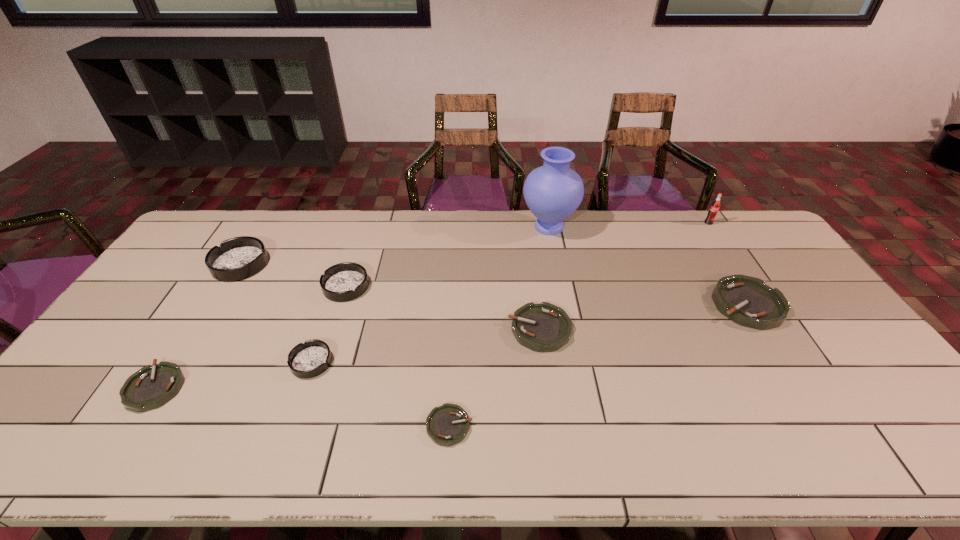
This screenshot has height=540, width=960. I want to click on green ashtray object that ranks as the third closest to the rightmost ashtray, so click(151, 387).

Identify which green ashtray is the third closest to the tallest object. Please provide its 2D coordinates. Your answer should be formatted as a tuple, i.e. [(x, y)], where the tuple contains the x and y coordinates of a point satisfying the conditions above.

[(446, 425)]

Find the location of `free space that satisfies the following two spatial constraints: 1. on the front side of the rightmost ashtray; 2. on the left side of the seventh shortest object`. free space that satisfies the following two spatial constraints: 1. on the front side of the rightmost ashtray; 2. on the left side of the seventh shortest object is located at coordinates (215, 305).